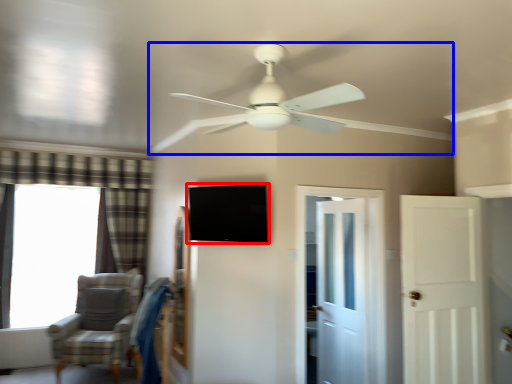
Question: Which point is closer to the camera, window screen (highlighted by a red box) or ceiling fan (highlighted by a blue box)?

Choices:
 (A) window screen
 (B) ceiling fan

Answer: (B)